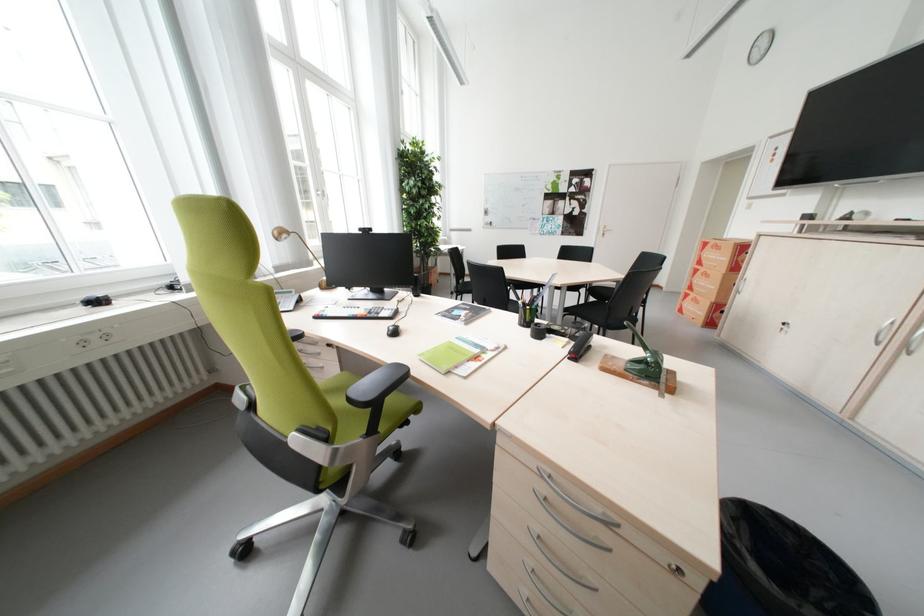
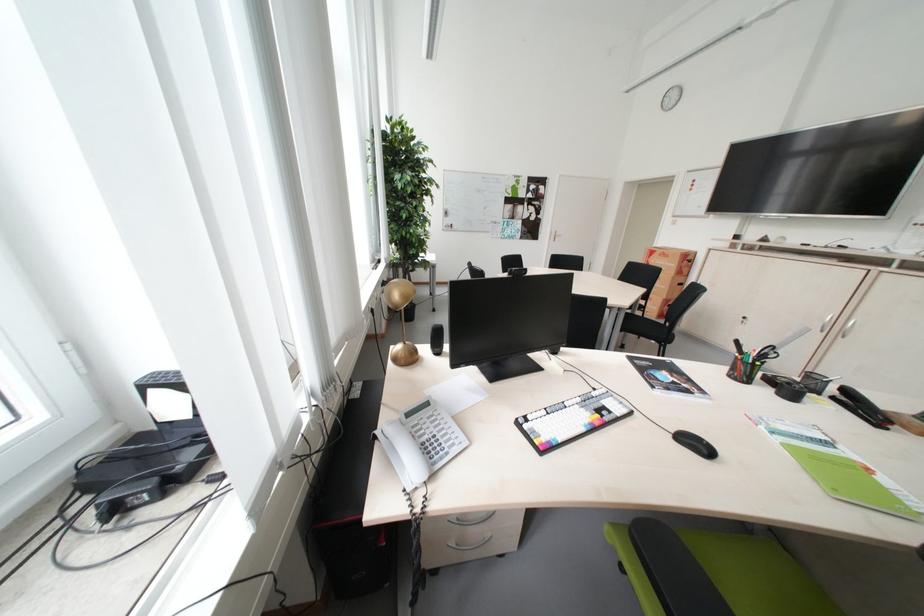
In a continuous first-person perspective shot, in which direction is the camera moving?

The cameraman walked toward left, forward.